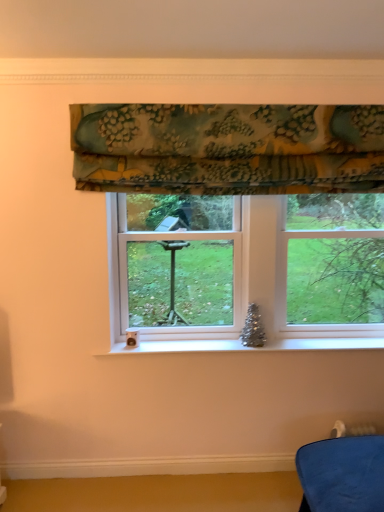
In order to click on vacant point above floral fabric valance at upper center (from a real-world perspective) in this screenshot , I will do `click(231, 100)`.